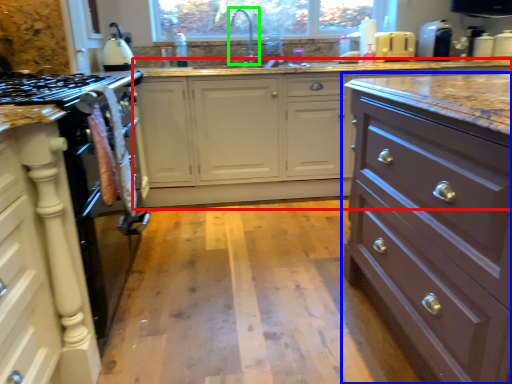
Question: Which is farther away from counter (highlighted by a red box)? chest of drawers (highlighted by a blue box) or faucet (highlighted by a green box)?

Choices:
 (A) chest of drawers
 (B) faucet

Answer: (A)